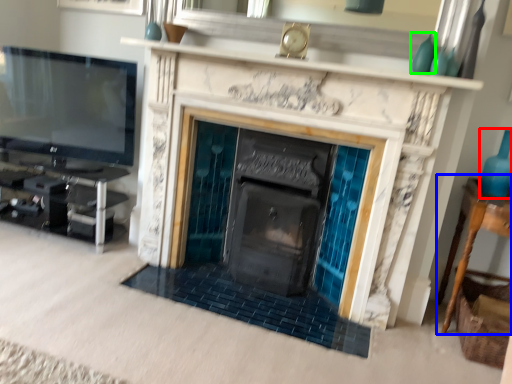
Question: Considering the real-world distances, which object is farthest from glass vase (highlighted by a red box)? table (highlighted by a blue box) or turquoise (highlighted by a green box)?

Choices:
 (A) table
 (B) turquoise

Answer: (B)